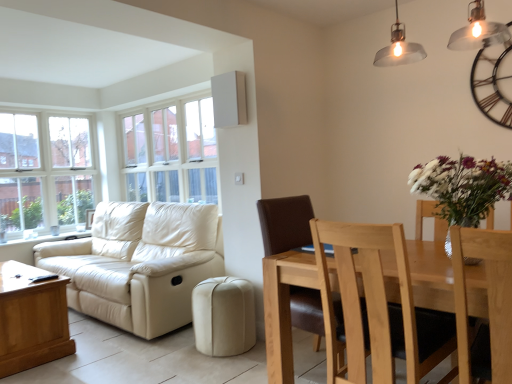
Question: Can you confirm if metallic black clock at upper right is wider than beige leather ottoman at lower center?

Choices:
 (A) no
 (B) yes

Answer: (A)

Question: Does metallic black clock at upper right come in front of beige leather ottoman at lower center?

Choices:
 (A) yes
 (B) no

Answer: (A)

Question: From the image's perspective, is metallic black clock at upper right beneath beige leather ottoman at lower center?

Choices:
 (A) yes
 (B) no

Answer: (B)

Question: From the image's perspective, would you say metallic black clock at upper right is positioned over beige leather ottoman at lower center?

Choices:
 (A) yes
 (B) no

Answer: (A)

Question: Is the position of metallic black clock at upper right more distant than that of beige leather ottoman at lower center?

Choices:
 (A) yes
 (B) no

Answer: (B)

Question: Would you consider metallic black clock at upper right to be distant from beige leather ottoman at lower center?

Choices:
 (A) no
 (B) yes

Answer: (B)

Question: From the image's perspective, is brown leather chair at center, placed as the first chair when sorted from back to front, on metallic black clock at upper right?

Choices:
 (A) no
 (B) yes

Answer: (A)

Question: Is brown leather chair at center, arranged as the third chair when viewed from the front, next to metallic black clock at upper right?

Choices:
 (A) yes
 (B) no

Answer: (B)

Question: Is brown leather chair at center, arranged as the third chair when viewed from the front, bigger than metallic black clock at upper right?

Choices:
 (A) no
 (B) yes

Answer: (B)

Question: Considering the relative positions of brown leather chair at center, arranged as the third chair when viewed from the front, and metallic black clock at upper right in the image provided, is brown leather chair at center, arranged as the third chair when viewed from the front, behind metallic black clock at upper right?

Choices:
 (A) yes
 (B) no

Answer: (B)

Question: Are brown leather chair at center, arranged as the third chair when viewed from the front, and metallic black clock at upper right far apart?

Choices:
 (A) no
 (B) yes

Answer: (B)

Question: Considering the relative sizes of brown leather chair at center, arranged as the third chair when viewed from the front, and metallic black clock at upper right in the image provided, is brown leather chair at center, arranged as the third chair when viewed from the front, smaller than metallic black clock at upper right?

Choices:
 (A) no
 (B) yes

Answer: (A)

Question: From the image's perspective, is matte silver pendant light at upper right on light brown wood chair at lower right, arranged as the 2th chair when viewed from the back?

Choices:
 (A) yes
 (B) no

Answer: (A)